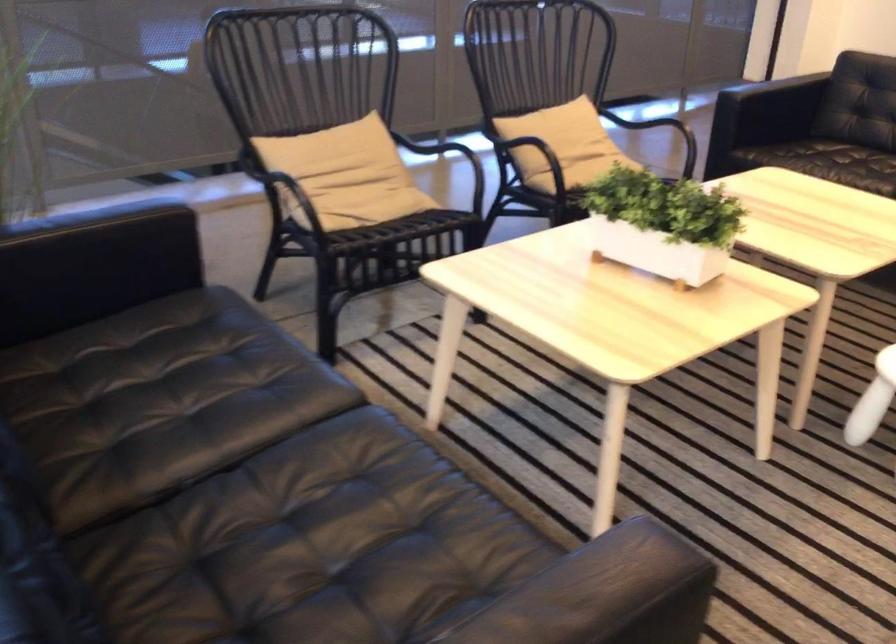
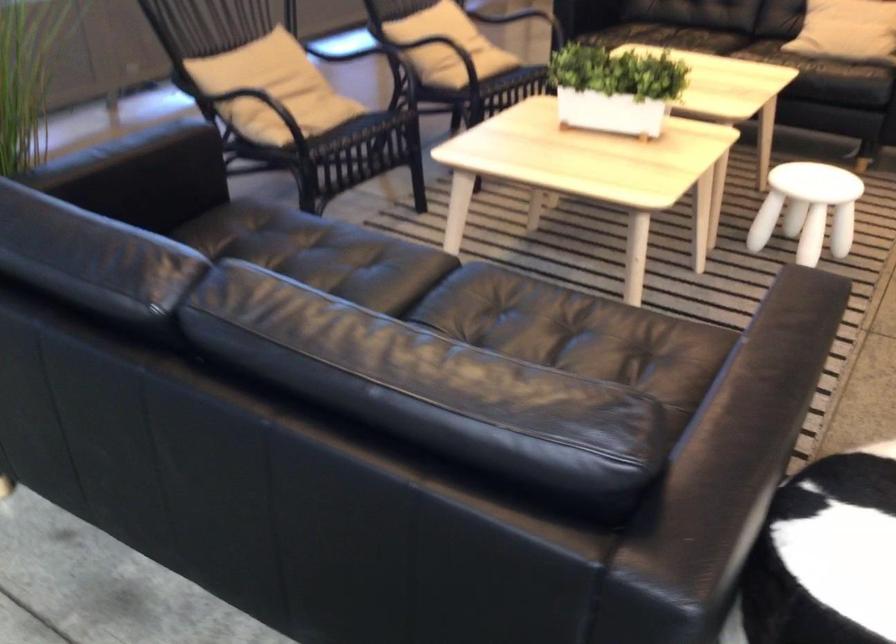
Locate, in the second image, the point that corresponds to (649,221) in the first image.

(615, 88)